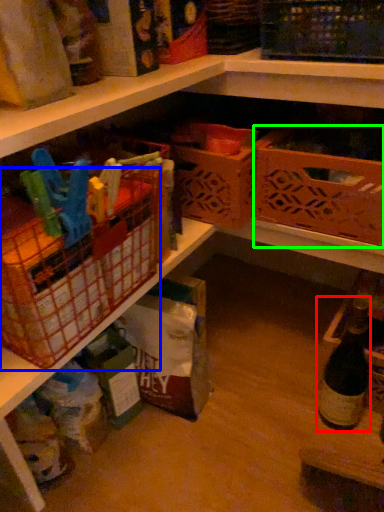
Question: Based on their relative distances, which object is nearer to bottle (highlighted by a red box)? Choose from basket (highlighted by a blue box) and basket (highlighted by a green box).

Choices:
 (A) basket
 (B) basket

Answer: (B)